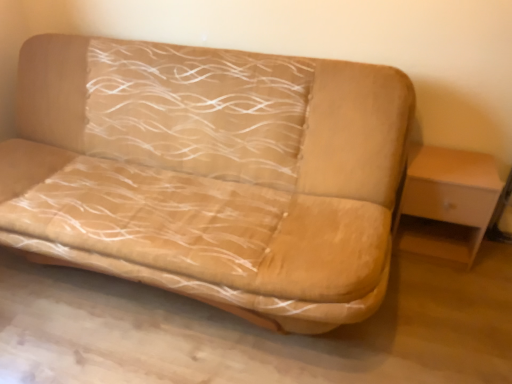
Describe the element at coordinates (210, 173) in the screenshot. The width and height of the screenshot is (512, 384). I see `beige fabric couch at center` at that location.

Identify the location of beige fabric couch at center. The width and height of the screenshot is (512, 384). (210, 173).

In order to face beige fabric couch at center, should I rotate leftwards or rightwards?

It's best to rotate left around 11.321 degrees.

What do you see at coordinates (448, 203) in the screenshot? The height and width of the screenshot is (384, 512). I see `light wood/wooden table at right` at bounding box center [448, 203].

Where is `light wood/wooden table at right`? This screenshot has width=512, height=384. light wood/wooden table at right is located at coordinates (448, 203).

Image resolution: width=512 pixels, height=384 pixels. What are the coordinates of `beige fabric couch at center` in the screenshot? It's located at (210, 173).

Which is more to the right, beige fabric couch at center or light wood/wooden table at right?

Positioned to the right is light wood/wooden table at right.

Does beige fabric couch at center lie in front of light wood/wooden table at right?

Yes, beige fabric couch at center is in front of light wood/wooden table at right.

Between point (347, 92) and point (449, 254), which one is positioned behind?

The point (449, 254) is farther from the camera.

From the image's perspective, would you say beige fabric couch at center is shown under light wood/wooden table at right?

No, from the image's perspective, beige fabric couch at center is not below light wood/wooden table at right.

From a real-world perspective, which is physically above, beige fabric couch at center or light wood/wooden table at right?

In real-world perspective, beige fabric couch at center is above.

Between beige fabric couch at center and light wood/wooden table at right, which one has larger width?

beige fabric couch at center.

Is beige fabric couch at center taller than light wood/wooden table at right?

Yes.

Is beige fabric couch at center bigger than light wood/wooden table at right?

Yes.

Can we say beige fabric couch at center lies outside light wood/wooden table at right?

beige fabric couch at center is positioned outside light wood/wooden table at right.

Are beige fabric couch at center and light wood/wooden table at right beside each other?

beige fabric couch at center and light wood/wooden table at right are clearly separated.

Is beige fabric couch at center positioned with its back to light wood/wooden table at right?

No, beige fabric couch at center is not facing away from light wood/wooden table at right.

Can you tell me how much beige fabric couch at center and light wood/wooden table at right differ in facing direction?

They differ by 0.74 degrees in their facing directions.

This screenshot has width=512, height=384. I want to click on studio couch above the light wood/wooden table at right (from the image's perspective), so click(210, 173).

Considering the relative positions of light wood/wooden table at right and beige fabric couch at center in the image provided, is light wood/wooden table at right to the left of beige fabric couch at center from the viewer's perspective?

No, light wood/wooden table at right is not to the left of beige fabric couch at center.

Considering the positions of objects light wood/wooden table at right and beige fabric couch at center in the image provided, who is behind, light wood/wooden table at right or beige fabric couch at center?

light wood/wooden table at right is behind.

Considering the positions of point (445, 254) and point (134, 249), is point (445, 254) closer or farther from the camera than point (134, 249)?

Point (445, 254) is farther from the camera than point (134, 249).

From the image's perspective, which is above, light wood/wooden table at right or beige fabric couch at center?

beige fabric couch at center, from the image's perspective.

From a real-world perspective, is light wood/wooden table at right physically located above or below beige fabric couch at center?

From a real-world perspective, light wood/wooden table at right is physically below beige fabric couch at center.

In terms of width, does light wood/wooden table at right look wider or thinner when compared to beige fabric couch at center?

light wood/wooden table at right is thinner than beige fabric couch at center.

Which of these two, light wood/wooden table at right or beige fabric couch at center, stands shorter?

light wood/wooden table at right is shorter.

Is light wood/wooden table at right bigger than beige fabric couch at center?

No, light wood/wooden table at right is not bigger than beige fabric couch at center.

Is light wood/wooden table at right inside or outside of beige fabric couch at center?

light wood/wooden table at right is not enclosed by beige fabric couch at center.

Is light wood/wooden table at right in contact with beige fabric couch at center?

No, light wood/wooden table at right is not beside beige fabric couch at center.

Is beige fabric couch at center at the back of light wood/wooden table at right?

light wood/wooden table at right does not have its back to beige fabric couch at center.

In the scene shown: How different are the orientations of light wood/wooden table at right and beige fabric couch at center in degrees?

The facing directions of light wood/wooden table at right and beige fabric couch at center are 0.74 degrees apart.

Identify the location of studio couch on the left of light wood/wooden table at right. (210, 173).

Where is `table that is below the beige fabric couch at center (from the image's perspective)`? This screenshot has width=512, height=384. table that is below the beige fabric couch at center (from the image's perspective) is located at coordinates (448, 203).

This screenshot has width=512, height=384. What are the coordinates of `table lying on the right of beige fabric couch at center` in the screenshot? It's located at (448, 203).